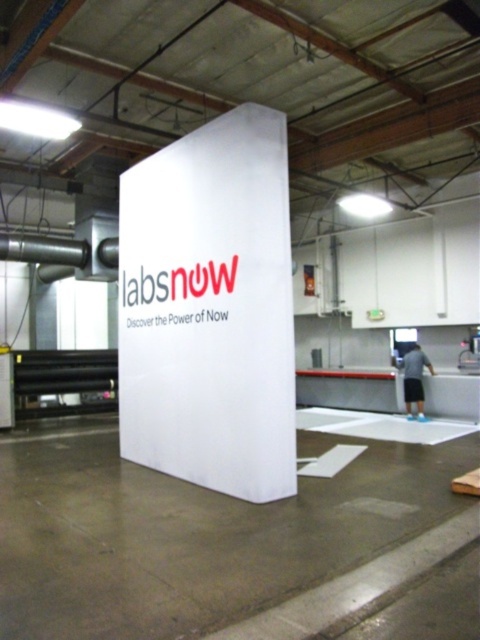
Consider the image. You are standing in the workshop and need to locate the white matte sign at center and the blue denim shorts at lower right. From your perspective, which object is positioned to the right?

The blue denim shorts at lower right are positioned to the right of the white matte sign at center.

You are standing in the workshop and want to see both the white matte sign at center and the blue denim shorts at lower right. Which one is located higher from the ground?

The white matte sign at center is above the blue denim shorts at lower right, so it is higher from the ground.

You are standing at the entrance of the workshop and want to place a 5.5 meter long ladder between the white matte sign at center and blue denim shorts at lower right. Is there enough space?

The distance between the white matte sign at center and blue denim shorts at lower right is 5.42 meters. Since the ladder is 5.5 meters long, it is slightly longer than the available space. Therefore, the ladder cannot be placed between them without overlapping or adjusting the position.